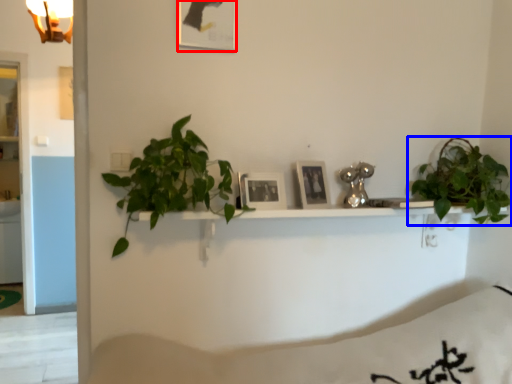
Question: Which of the following is the closest to the observer, picture frame (highlighted by a red box) or houseplant (highlighted by a blue box)?

Choices:
 (A) picture frame
 (B) houseplant

Answer: (A)